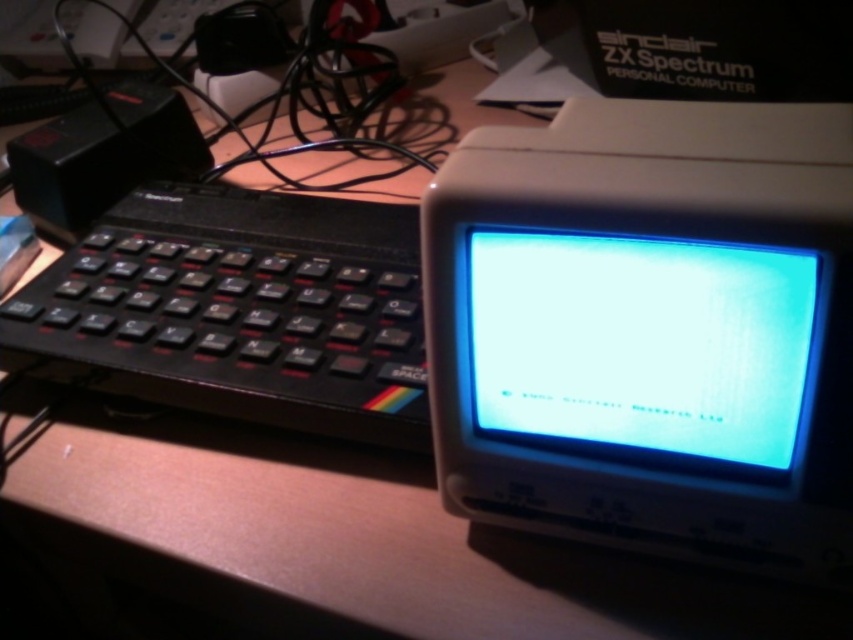
Is point (512, 323) closer to viewer compared to point (314, 273)?

Yes.

Which of these two, white plastic monitor at center or black plastic keyboard at left, stands shorter?

Standing shorter between the two is black plastic keyboard at left.

Locate an element on the screen. white plastic monitor at center is located at coordinates (648, 330).

Is white plastic monitor at center above matte plastic monitor at center?

Yes.

Which is in front, point (744, 460) or point (733, 333)?

Positioned in front is point (733, 333).

Identify the location of white plastic monitor at center. (648, 330).

Image resolution: width=853 pixels, height=640 pixels. Describe the element at coordinates (239, 310) in the screenshot. I see `black plastic keyboard at left` at that location.

Is point (206, 218) in front of point (677, 237)?

No, (206, 218) is behind (677, 237).

Find the location of `black plastic keyboard at left`. black plastic keyboard at left is located at coordinates (239, 310).